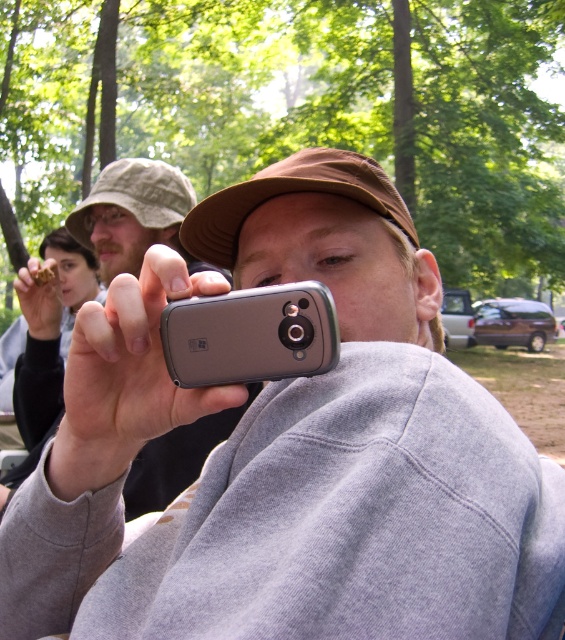
Question: Which object appears closest to the camera in this image?

Choices:
 (A) silver metallic phone at center
 (B) silver metallic smartphone at center

Answer: (A)

Question: Which point appears farthest from the camera in this image?

Choices:
 (A) (84, 237)
 (B) (168, 372)

Answer: (A)

Question: Can you confirm if silver metallic phone at center is positioned to the left of silver metallic smartphone at center?

Choices:
 (A) yes
 (B) no

Answer: (A)

Question: Does silver metallic phone at center appear on the right side of silver metallic smartphone at center?

Choices:
 (A) no
 (B) yes

Answer: (A)

Question: Can you confirm if silver metallic phone at center is positioned to the left of silver metallic smartphone at center?

Choices:
 (A) yes
 (B) no

Answer: (A)